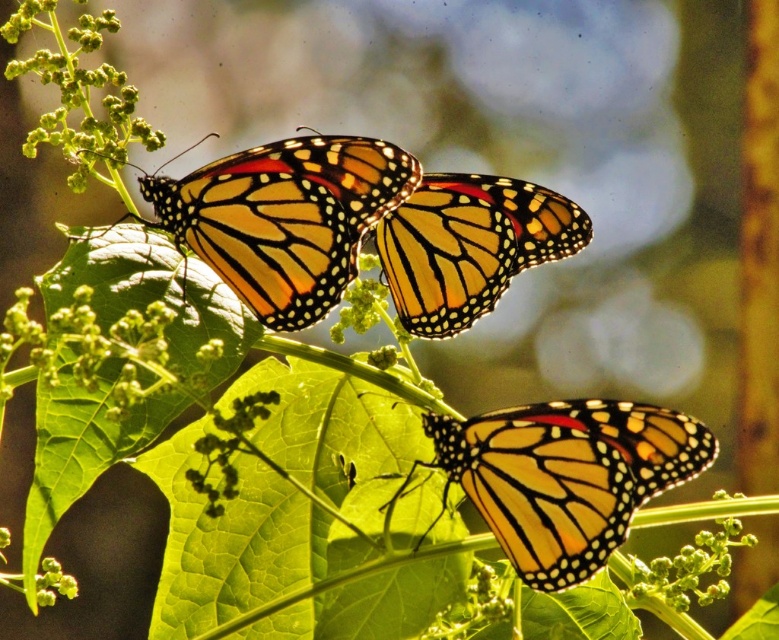
Question: Can you confirm if yellow-orange wings at center is bigger than green matte flower at center?

Choices:
 (A) yes
 (B) no

Answer: (A)

Question: Is green fuzzy plant at upper left to the left of green matte flower at center from the viewer's perspective?

Choices:
 (A) yes
 (B) no

Answer: (A)

Question: Considering the real-world distances, which object is farthest from the orange and black spotted wings at upper left?

Choices:
 (A) green matte flower at center
 (B) orange-yellow wings at center
 (C) yellow-orange wings at center

Answer: (C)

Question: Which object is positioned closest to the orange-yellow wings at center?

Choices:
 (A) orange and black spotted wings at upper left
 (B) green fuzzy plant at upper left

Answer: (A)

Question: Which point is closer to the camera?

Choices:
 (A) green fuzzy plant at upper left
 (B) yellow-orange wings at center

Answer: (A)

Question: Is orange-yellow wings at center thinner than green fuzzy plant at upper left?

Choices:
 (A) yes
 (B) no

Answer: (A)